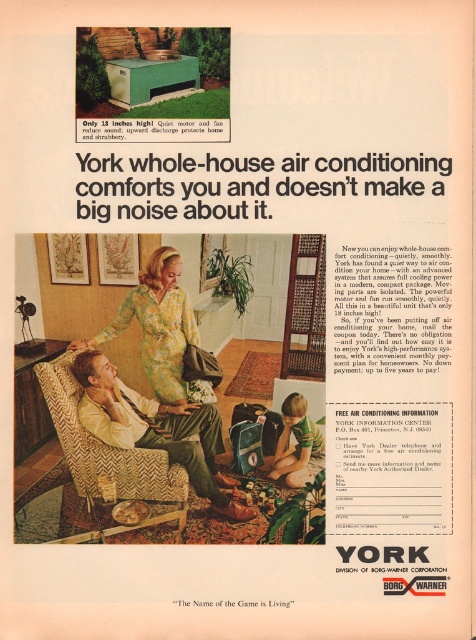
Is herringbone fabric chair at lower left taller than green floral dress at center?

Yes.

Is herringbone fabric chair at lower left positioned before green floral dress at center?

Yes.

Between point (52, 364) and point (159, 340), which one is positioned in front?

Point (52, 364)

I want to click on herringbone fabric chair at lower left, so click(107, 464).